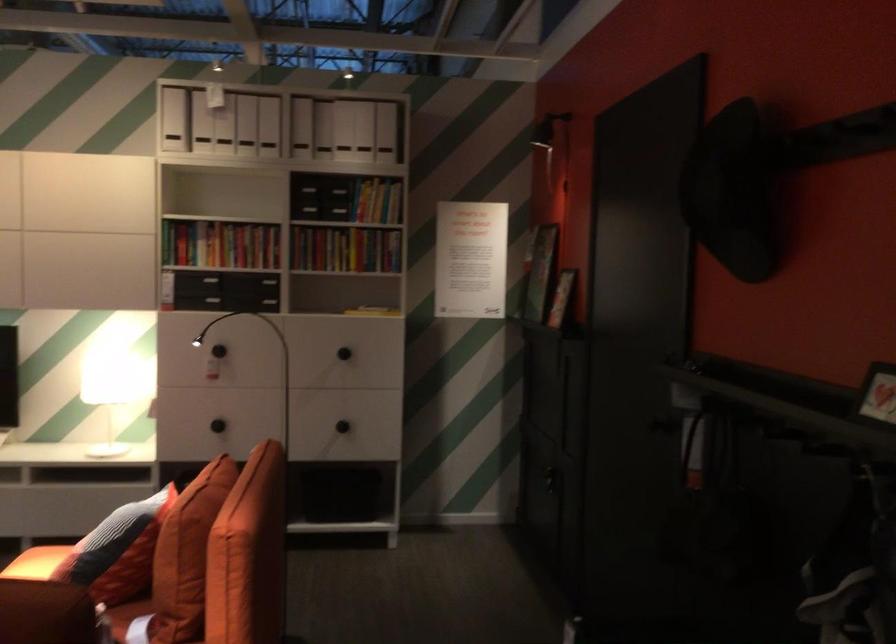
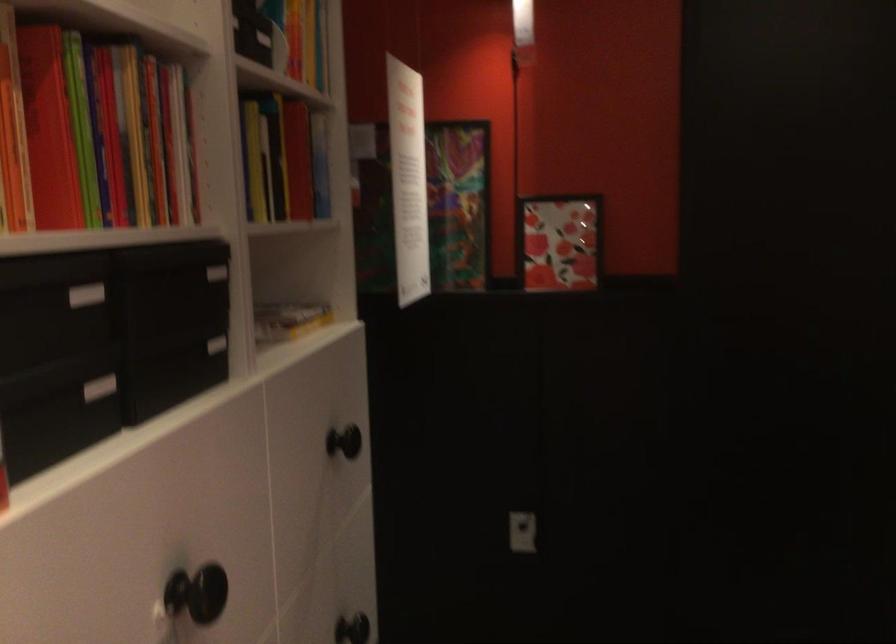
Find the pixel in the second image that matches point (204, 341) in the first image.

(196, 592)